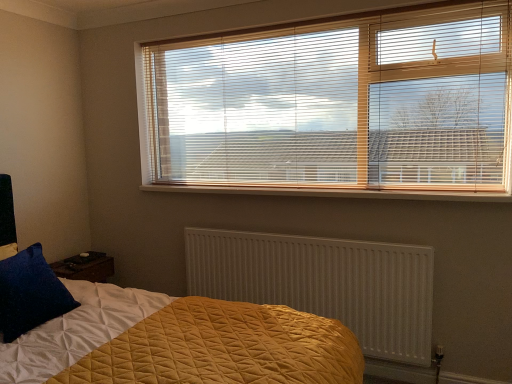
Question: From the image's perspective, is velvety blue pillow at lower left located above wooden at center?

Choices:
 (A) no
 (B) yes

Answer: (A)

Question: Can you see velvety blue pillow at lower left touching wooden at center?

Choices:
 (A) yes
 (B) no

Answer: (B)

Question: From a real-world perspective, is velvety blue pillow at lower left below wooden at center?

Choices:
 (A) no
 (B) yes

Answer: (B)

Question: Does velvety blue pillow at lower left have a lesser height compared to wooden at center?

Choices:
 (A) no
 (B) yes

Answer: (A)

Question: Is velvety blue pillow at lower left smaller than wooden at center?

Choices:
 (A) no
 (B) yes

Answer: (A)

Question: From a real-world perspective, relative to white textured radiator at center, is wooden blinds at upper center vertically above or below?

Choices:
 (A) below
 (B) above

Answer: (B)

Question: Considering the relative positions of wooden blinds at upper center and white textured radiator at center in the image provided, is wooden blinds at upper center to the left or to the right of white textured radiator at center?

Choices:
 (A) right
 (B) left

Answer: (A)

Question: In terms of size, does wooden blinds at upper center appear bigger or smaller than white textured radiator at center?

Choices:
 (A) big
 (B) small

Answer: (A)

Question: In terms of width, does wooden blinds at upper center look wider or thinner when compared to white textured radiator at center?

Choices:
 (A) wide
 (B) thin

Answer: (A)

Question: Choose the correct answer: Is wooden at center inside velvety blue pillow at lower left or outside it?

Choices:
 (A) outside
 (B) inside

Answer: (A)

Question: From the image's perspective, is wooden at center located above or below velvety blue pillow at lower left?

Choices:
 (A) below
 (B) above

Answer: (B)

Question: Considering the positions of wooden at center and velvety blue pillow at lower left in the image, is wooden at center wider or thinner than velvety blue pillow at lower left?

Choices:
 (A) thin
 (B) wide

Answer: (B)

Question: In terms of height, does wooden at center look taller or shorter compared to velvety blue pillow at lower left?

Choices:
 (A) tall
 (B) short

Answer: (B)

Question: Would you say wooden blinds at upper center is inside or outside wooden at center?

Choices:
 (A) inside
 (B) outside

Answer: (B)

Question: Is wooden blinds at upper center wider or thinner than wooden at center?

Choices:
 (A) wide
 (B) thin

Answer: (B)